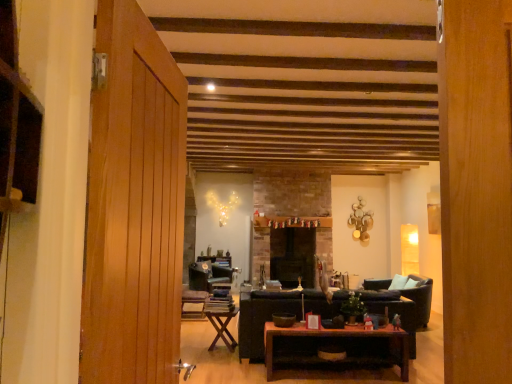
What do you see at coordinates (276, 313) in the screenshot? I see `dark brown leather couch at center` at bounding box center [276, 313].

The height and width of the screenshot is (384, 512). Describe the element at coordinates (335, 336) in the screenshot. I see `wooden polished coffee table at center` at that location.

This screenshot has height=384, width=512. What do you see at coordinates (134, 206) in the screenshot?
I see `wooden door at left` at bounding box center [134, 206].

In order to face velvet dark blue chair at center, the first chair from the back, should I rotate leftwards or rightwards?

It's best to rotate left around 6.513 degrees.

Measure the distance between point (217,328) and camera.

They are 4.93 meters apart.

The height and width of the screenshot is (384, 512). I want to click on black stone fireplace at center, so tap(293, 256).

Which of these two, black stone fireplace at center or wooden polished coffee table at center, is thinner?

With smaller width is wooden polished coffee table at center.

Are black stone fireplace at center and wooden polished coffee table at center beside each other?

They are not placed beside each other.

From a real-world perspective, is black stone fireplace at center physically below wooden polished coffee table at center?

Actually, black stone fireplace at center is physically above wooden polished coffee table at center in the real world.

Is black stone fireplace at center positioned behind wooden polished coffee table at center?

Yes, black stone fireplace at center is further from the camera.

Does point (381, 285) lie in front of point (129, 222)?

No, (381, 285) is further to viewer.

Is leather armchair at right facing towards wooden door at left?

No, leather armchair at right does not turn towards wooden door at left.

What's the angular difference between leather armchair at right and wooden door at left's facing directions?

A: 178 degrees separate the facing orientations of leather armchair at right and wooden door at left.

From a real-world perspective, is leather armchair at right physically below wooden door at left?

Yes, from a real-world perspective, leather armchair at right is under wooden door at left.

Looking at this image, which object is closer to the camera, black stone fireplace at center or velvet dark blue chair at center, the first chair from the back?

velvet dark blue chair at center, the first chair from the back.

Is black stone fireplace at center at the left side of velvet dark blue chair at center, marked as the second chair in a front-to-back arrangement?

No, black stone fireplace at center is not to the left of velvet dark blue chair at center, marked as the second chair in a front-to-back arrangement.

Is velvet dark blue chair at center, the first chair from the back, located within black stone fireplace at center?

No.

Is wooden folding table at center oriented towards wooden door at left?

No, wooden folding table at center is not oriented towards wooden door at left.

Does point (226, 326) come behind point (157, 196)?

Yes.

From the image's perspective, does wooden folding table at center appear lower than wooden door at left?

Indeed, from the image's perspective, wooden folding table at center is shown beneath wooden door at left.

Where is `studio couch that is on the right side of wooden folding table at center`? studio couch that is on the right side of wooden folding table at center is located at coordinates (276, 313).

How different are the orientations of dark brown leather couch at center and wooden folding table at center in degrees?

The angular difference between dark brown leather couch at center and wooden folding table at center is 6.09 degrees.

Which object is further away from the camera taking this photo, dark brown leather couch at center or wooden folding table at center?

wooden folding table at center.

Between point (192, 271) and point (217, 317), which one is positioned in front?

The point (217, 317) is closer to the camera.

In the image, is velvet dark blue chair at center, marked as the second chair in a front-to-back arrangement, positioned in front of or behind wooden folding table at center?

velvet dark blue chair at center, marked as the second chair in a front-to-back arrangement, is positioned farther from the viewer than wooden folding table at center.

Which of these two, velvet dark blue chair at center, the first chair from the back, or wooden folding table at center, is thinner?

wooden folding table at center is thinner.

Is velvet dark blue chair at center, the first chair from the back, to the right of wooden folding table at center from the viewer's perspective?

No.

Does point (167, 308) lie behind point (205, 279)?

That is False.

From the image's perspective, is wooden door at left on velvet dark blue chair at center, marked as the second chair in a front-to-back arrangement?

Yes.

In the image, is wooden door at left positioned in front of or behind velvet dark blue chair at center, marked as the second chair in a front-to-back arrangement?

wooden door at left is positioned closer to the viewer than velvet dark blue chair at center, marked as the second chair in a front-to-back arrangement.

Find the location of a particular element. This screenshot has width=512, height=384. fireplace that appears above the wooden polished coffee table at center (from the image's perspective) is located at coordinates (293, 256).

Where is `door that appears on the left of leather armchair at right`? The image size is (512, 384). door that appears on the left of leather armchair at right is located at coordinates coord(134,206).

Looking at the image, which one is located closer to wooden textured chair at center, the second chair when ordered from back to front, wooden folding table at center or wooden door at left?

wooden folding table at center is closer to wooden textured chair at center, the second chair when ordered from back to front.

Looking at the image, which one is located further to wooden folding table at center, velvet dark blue chair at center, marked as the second chair in a front-to-back arrangement, or wooden door at left?

wooden door at left lies further to wooden folding table at center than the other object.

From the image, which object appears to be nearer to black stone fireplace at center, velvet dark blue chair at center, marked as the second chair in a front-to-back arrangement, or wooden door at left?

velvet dark blue chair at center, marked as the second chair in a front-to-back arrangement.

Considering their positions, is leather armchair at right positioned closer to wooden door at left than black stone fireplace at center?

leather armchair at right lies closer to wooden door at left than the other object.

Which object lies nearer to the anchor point black stone fireplace at center, wooden door at left or leather armchair at right?

leather armchair at right is closer to black stone fireplace at center.

From the image, which object appears to be farther from leather armchair at right, dark brown leather couch at center or wooden polished coffee table at center?

wooden polished coffee table at center lies further to leather armchair at right than the other object.

When comparing their distances from wooden folding table at center, does black stone fireplace at center or wooden textured chair at center, the 1th chair viewed from the front, seem further?

black stone fireplace at center.

Looking at this image, estimate the real-world distances between objects in this image. Which object is further from dark brown leather couch at center, velvet dark blue chair at center, the first chair from the back, or wooden polished coffee table at center?

Among the two, velvet dark blue chair at center, the first chair from the back, is located further to dark brown leather couch at center.

The height and width of the screenshot is (384, 512). Find the location of `table between wooden door at left and velvet dark blue chair at center, marked as the second chair in a front-to-back arrangement, along the z-axis`. table between wooden door at left and velvet dark blue chair at center, marked as the second chair in a front-to-back arrangement, along the z-axis is located at coordinates (222, 327).

The width and height of the screenshot is (512, 384). In order to click on chair between wooden door at left and velvet dark blue chair at center, the first chair from the back, from front to back in this screenshot , I will do `click(193, 304)`.

Locate an element on the screen. The width and height of the screenshot is (512, 384). table between wooden polished coffee table at center and wooden textured chair at center, the 1th chair viewed from the front, along the z-axis is located at coordinates (222, 327).

In order to click on studio couch between wooden door at left and black stone fireplace at center from front to back in this screenshot , I will do `click(276, 313)`.